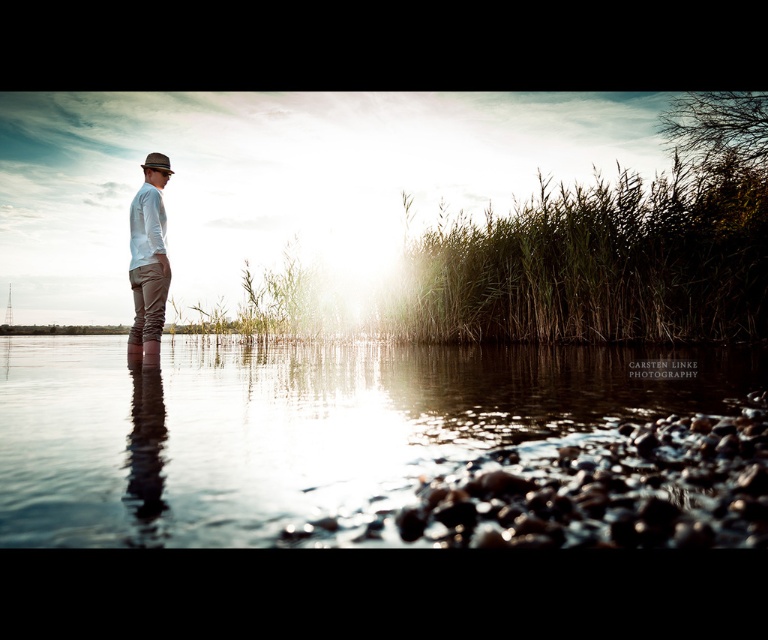
You are a photographer wanting to capture the reflection of the matte white shirt at center in the clear water at center. Based on the scene, will the reflection be fully visible in the water?

The clear water at center is not as tall as matte white shirt at center, meaning the reflection may not be fully visible since the water level is lower than the shirt.

You are a photographer trying to capture the reflection of the matte white shirt at center in the clear water at center. Based on the scene, can you confirm if the reflection is visible?

The clear water at center is located below the matte white shirt at center, so the reflection of the matte white shirt at center is visible in the clear water at center.